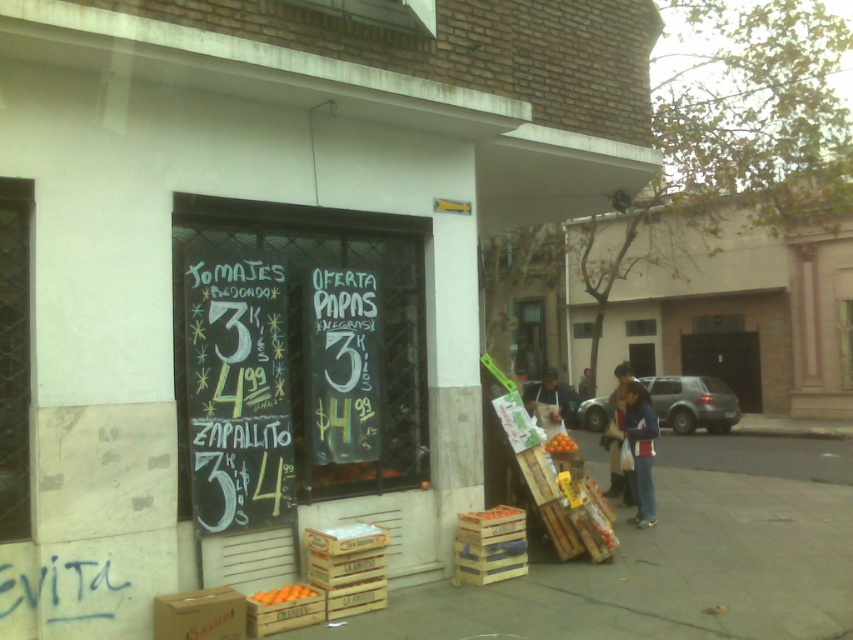
You are a customer standing in front of the storefront. You notice two items of interest on the ground near the entrance. The black graffiti at lower left and the dark blue jeans at lower right. Which item is positioned higher relative to the other?

The black graffiti at lower left is located above dark blue jeans at lower right, so the black graffiti at lower left is higher than the dark blue jeans at lower right.

Looking at this image, you are a delivery person who needs to place a package between the black graffiti at lower left and the dark blue jeans at lower right. The package is 7 feet long. Can you fit it in the space between them?

The distance between the black graffiti at lower left and the dark blue jeans at lower right is 75.42 feet, so yes, the 7 feet long package can fit in the space between them since it is significantly shorter than the available distance.

You are standing in front of the store and want to locate two specific points marked on the chalkboard sign. The first point is at coordinate point [305,589] and the second is at point [554,444]. Which of these points is nearer to you?

Point [305,589] is closer to the viewer than point [554,444].